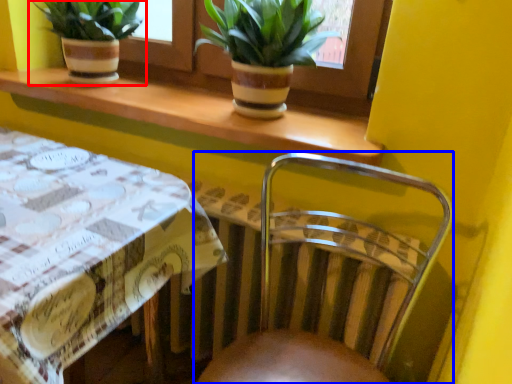
Question: Which of the following is the farthest to the observer, houseplant (highlighted by a red box) or chair (highlighted by a blue box)?

Choices:
 (A) houseplant
 (B) chair

Answer: (A)